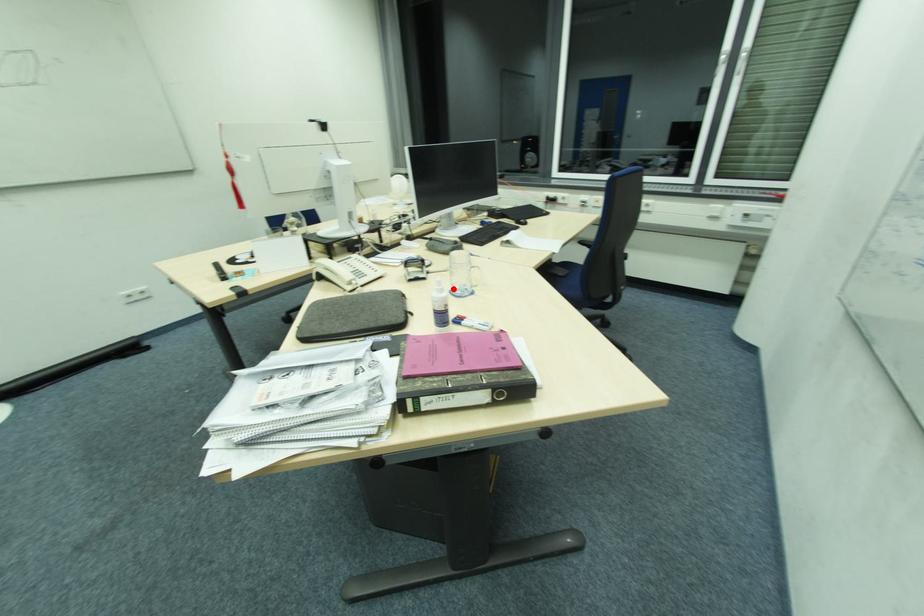
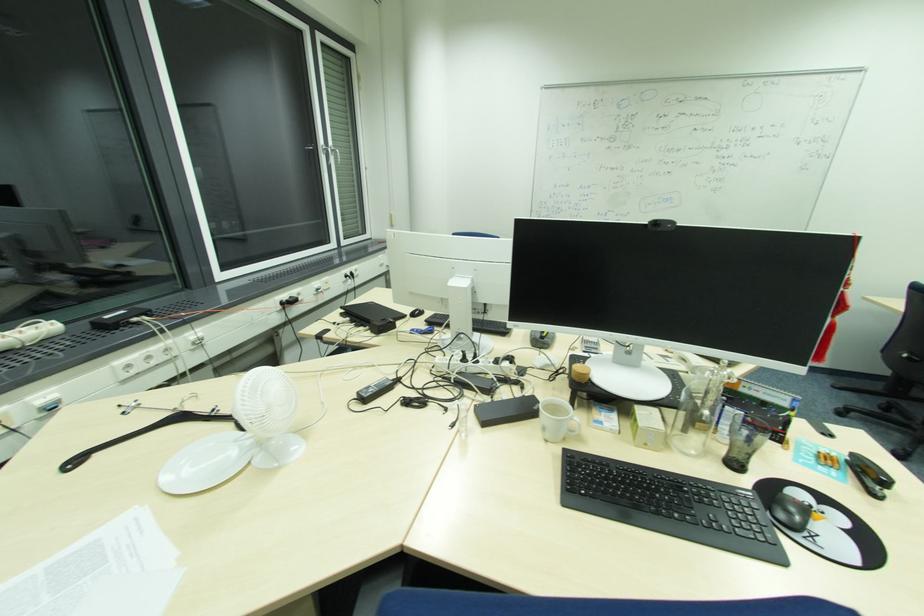
Question: I am providing you with two images of the same scene from different viewpoints. A red point is marked on the first image. Can you still see the location of the red point in image 2?

Choices:
 (A) Yes
 (B) No

Answer: (B)